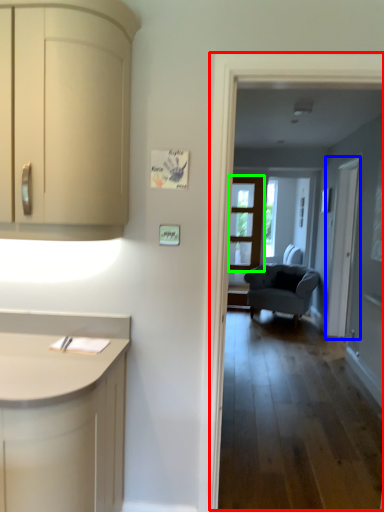
Question: Considering the real-world distances, which object is farthest from corridor (highlighted by a red box)? screen door (highlighted by a blue box) or door (highlighted by a green box)?

Choices:
 (A) screen door
 (B) door

Answer: (B)